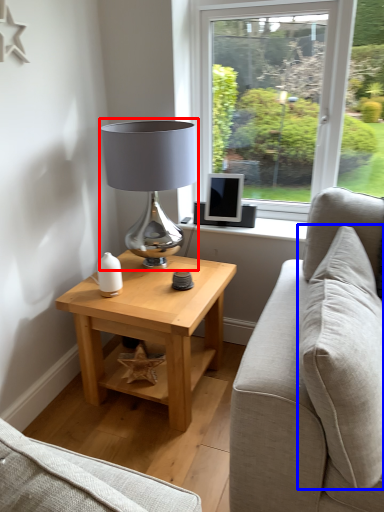
Question: Which point is further to the camera, table lamp (highlighted by a red box) or pillow (highlighted by a blue box)?

Choices:
 (A) table lamp
 (B) pillow

Answer: (A)